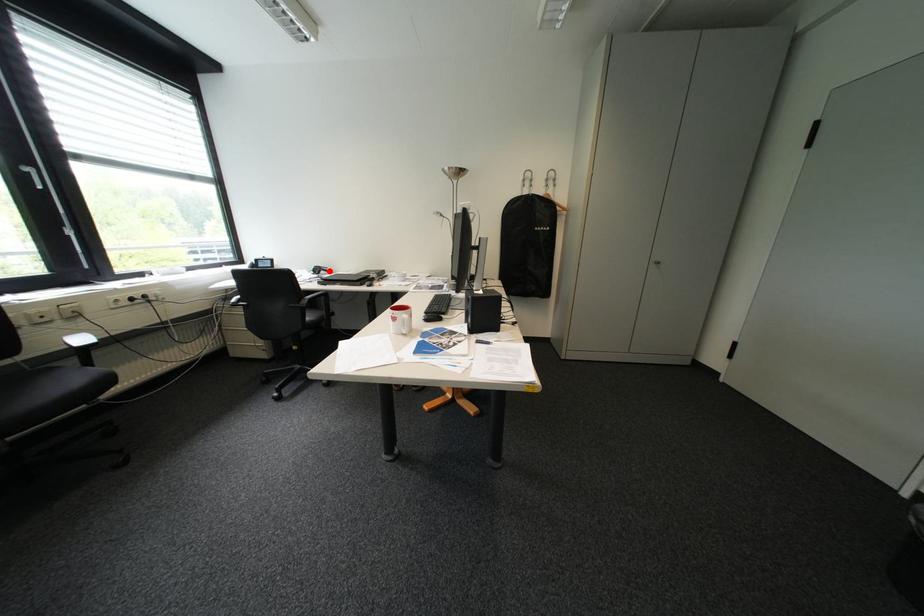
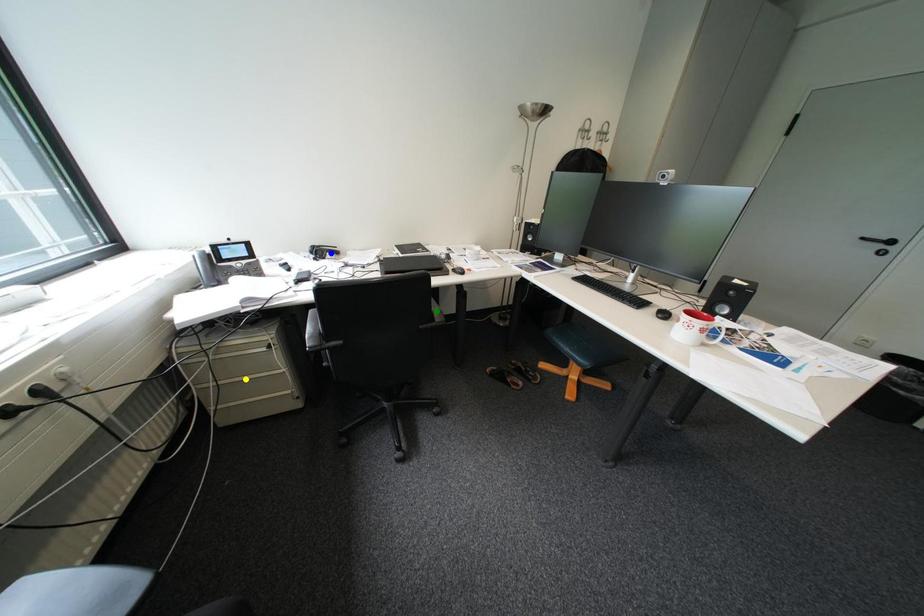
Question: I am providing you with two images of the same scene from different viewpoints. A red point is marked on the first image. You are given multiple points on the second image. Which point in image 2 represents the same 3d spot as the red point in image 1?

Choices:
 (A) green point
 (B) yellow point
 (C) blue point

Answer: (C)